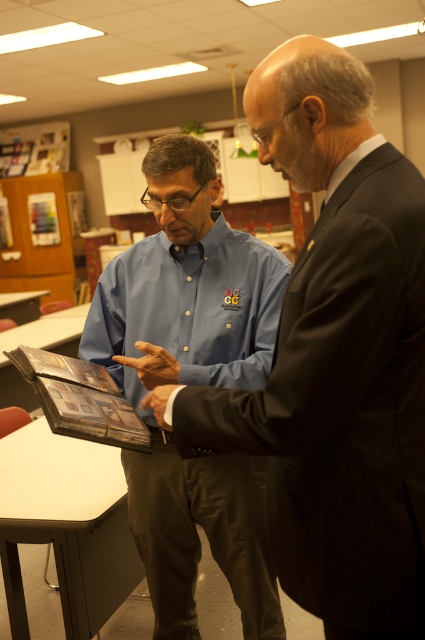
You are organizing a meeting and need to place a name tag on the table. The name tag is 10 cm wide. Is there enough space on the white glossy table at lower left to place it without overlapping the blue cotton shirt at center?

The blue cotton shirt at center is to the right of the white glossy table at lower left, so there should be sufficient space on the left side of the table to place the name tag without overlapping the shirt.

You are an HR representative observing two candidates in an interview. The candidates are wearing the blue shirt at center and the blue cotton shirt at center. Which candidate is wearing a smaller sized shirt?

The blue shirt at center has a smaller size compared to the blue cotton shirt at center, so the candidate wearing the blue shirt at center is the one with the smaller sized shirt.